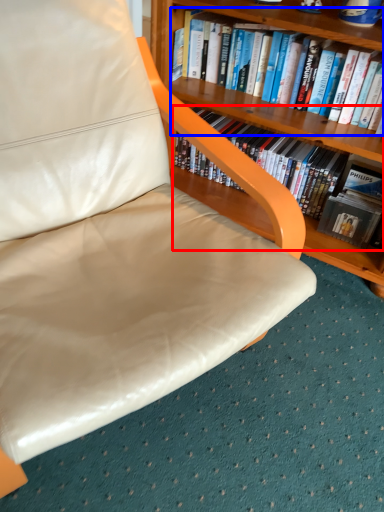
Question: Which of the following is the farthest to the observer, book (highlighted by a red box) or book (highlighted by a blue box)?

Choices:
 (A) book
 (B) book

Answer: (A)